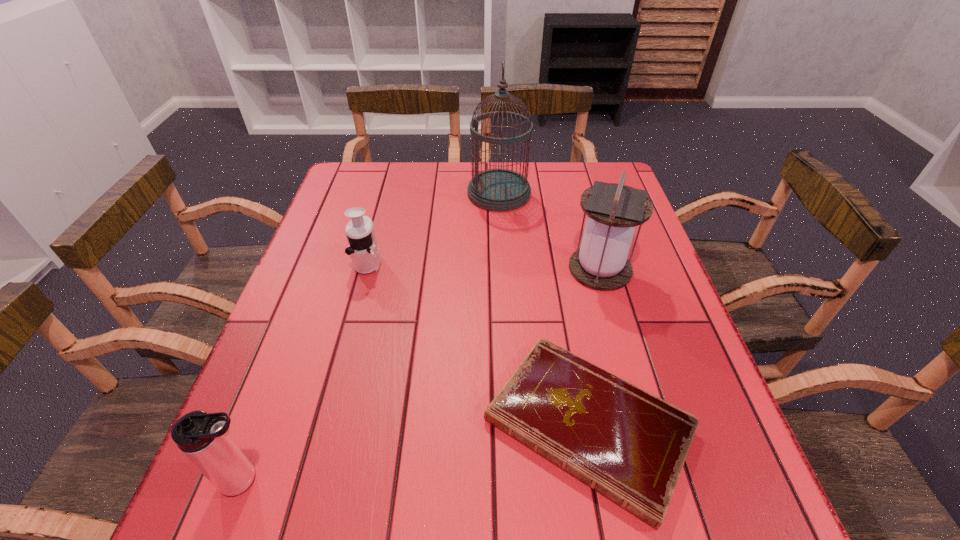
At what (x,y) coordinates should I click in order to perform the action: click on notebook at the right edge. Please return your answer as a coordinate pair (x, y). This screenshot has width=960, height=540. Looking at the image, I should click on (627, 444).

I want to click on object located at the near left corner, so click(203, 438).

I want to click on object present at the near right corner, so click(x=627, y=444).

Locate an element on the screen. Image resolution: width=960 pixels, height=540 pixels. free space at the far edge of the desktop is located at coordinates (448, 192).

Find the location of a particular element. This screenshot has width=960, height=540. free spot at the near edge of the desktop is located at coordinates (572, 492).

In the image, there is a desktop. Where is `free space at the left edge`? The image size is (960, 540). free space at the left edge is located at coordinates (345, 332).

At what (x,y) coordinates should I click in order to perform the action: click on free region at the right edge. Please return your answer as a coordinate pair (x, y). The image size is (960, 540). Looking at the image, I should click on (649, 361).

At what (x,y) coordinates should I click in order to perform the action: click on blank area at the far left corner. Please return your answer as a coordinate pair (x, y). Looking at the image, I should click on (344, 197).

In order to click on free region at the near left corner of the desktop in this screenshot , I will do `click(278, 497)`.

Find the location of `blank space at the far right corner of the desktop`. blank space at the far right corner of the desktop is located at coordinates (582, 173).